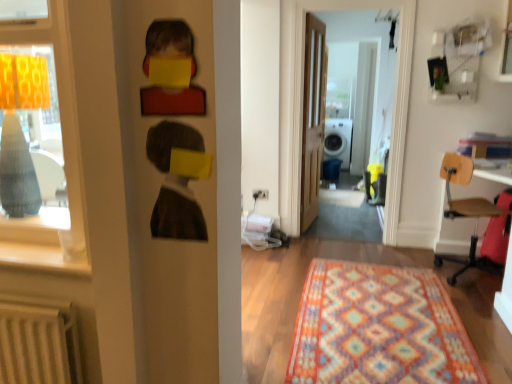
Locate an element on the screen. vacant area that is situated to the right of wooden door at center is located at coordinates (340, 224).